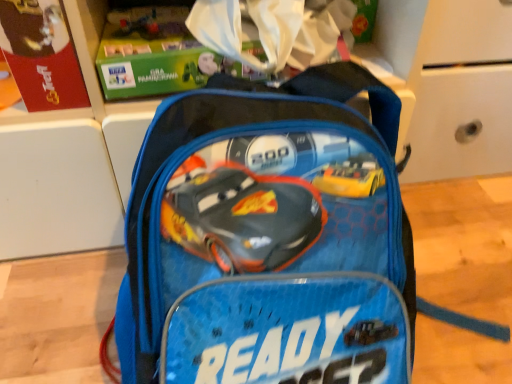
In order to face blue fabric backpack at center, should I rotate leftwards or rightwards?

It's best to rotate right around 10.167 degrees.

This screenshot has width=512, height=384. What do you see at coordinates (271, 239) in the screenshot?
I see `blue fabric backpack at center` at bounding box center [271, 239].

At what (x,y) coordinates should I click in order to perform the action: click on blue fabric backpack at center. Please return your answer as a coordinate pair (x, y). The image size is (512, 384). Looking at the image, I should click on [271, 239].

The height and width of the screenshot is (384, 512). Identify the location of blue fabric backpack at center. (271, 239).